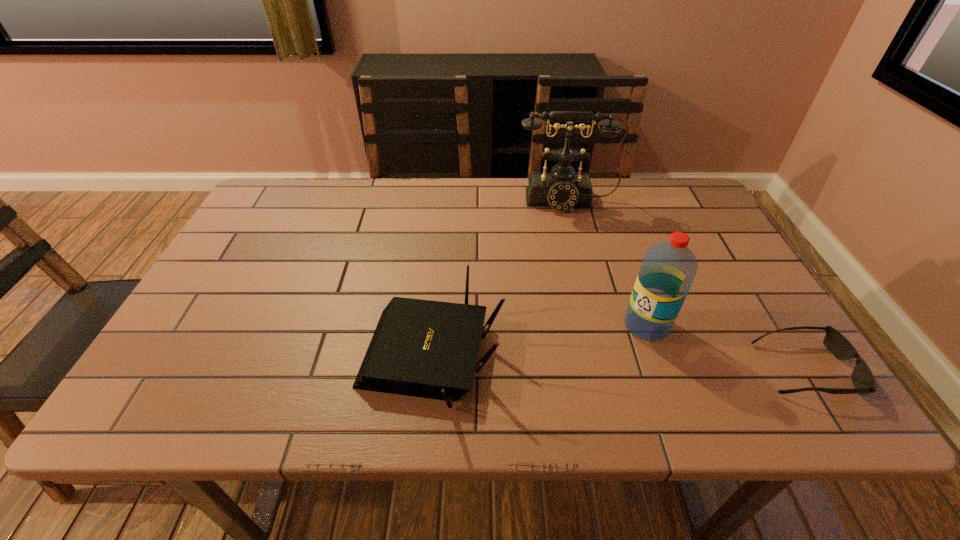
Locate an element on the screen. The image size is (960, 540). vacant space on the desktop that is between the router and the sunglasses and is positioned on the dial of the telephone is located at coordinates (594, 363).

In order to click on vacant spot on the desktop that is between the leftmost object and the rightmost object and is positioned on the front label of the water bottle in this screenshot , I will do `click(570, 362)`.